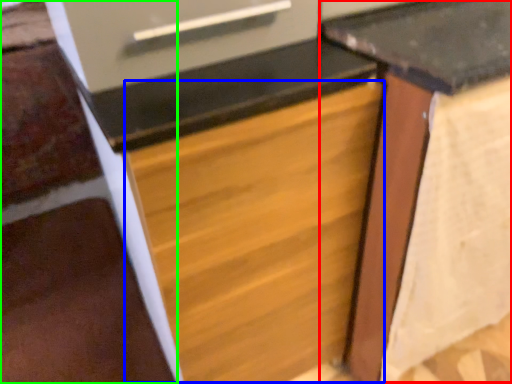
Question: Which object is positioned closest to table (highlighted by a red box)? Select from drawer (highlighted by a blue box) and stairwell (highlighted by a green box).

Choices:
 (A) drawer
 (B) stairwell

Answer: (A)